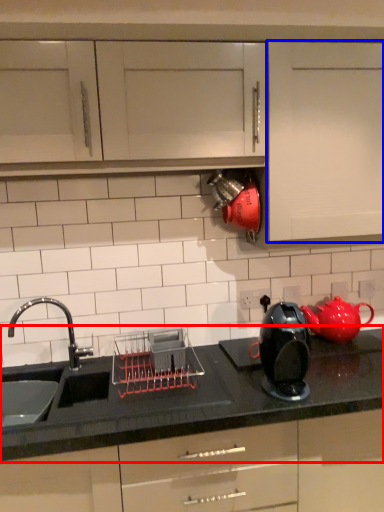
Question: Which point is further to the camera, countertop (highlighted by a red box) or cabinetry (highlighted by a blue box)?

Choices:
 (A) countertop
 (B) cabinetry

Answer: (B)